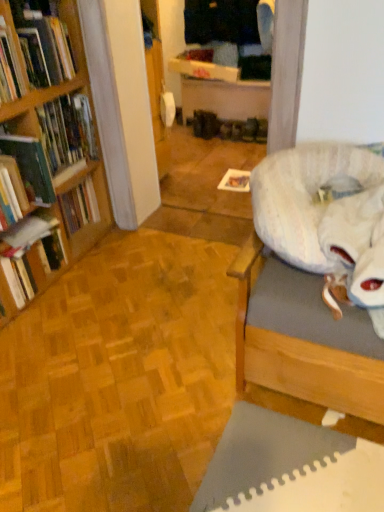
Question: Looking at the image, does wooden bookshelf at left, which is the first book from top to bottom, seem bigger or smaller compared to hardcover book at left, acting as the fourth book starting from the top?

Choices:
 (A) small
 (B) big

Answer: (B)

Question: From the image's perspective, is wooden bookshelf at left, which is the first book from top to bottom, positioned above or below hardcover book at left, positioned as the first book in bottom-to-top order?

Choices:
 (A) below
 (B) above

Answer: (B)

Question: Which is nearer to the fluffy white bean bag at right?

Choices:
 (A) hardcover book at left, positioned as the first book in bottom-to-top order
 (B) wooden bookshelf at left, which is the first book from top to bottom
 (C) matte brown shoe at center
 (D) hardcover book at left, positioned as the second book in bottom-to-top order
 (E) green matte bookshelf at left, the 3th book when ordered from bottom to top

Answer: (D)

Question: Which object is the farthest from the wooden bookshelf at left, which is the first book from top to bottom?

Choices:
 (A) matte brown shoe at center
 (B) hardcover book at left, positioned as the second book in bottom-to-top order
 (C) green matte bookshelf at left, the second book in the top-to-bottom sequence
 (D) fluffy white bean bag at right
 (E) hardcover book at left, acting as the fourth book starting from the top

Answer: (A)